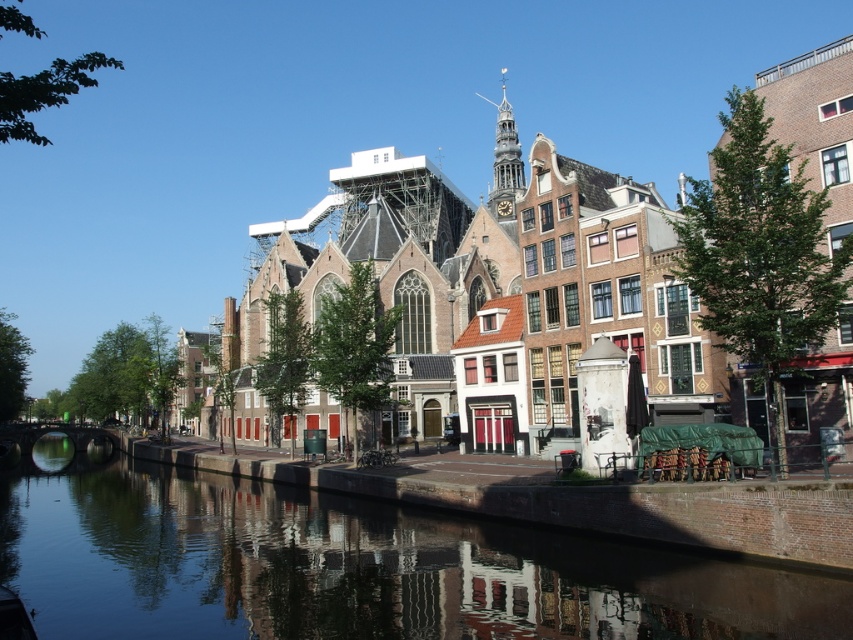
Is point (804, 292) positioned behind point (614, 611)?

Yes, it is behind point (614, 611).

Can you confirm if brown brick church at center is thinner than smooth water at center?

Correct, brown brick church at center's width is less than smooth water at center's.

Measure the distance between point (614, 266) and camera.

The distance of point (614, 266) from camera is 61.97 meters.

I want to click on brown brick church at center, so click(596, 284).